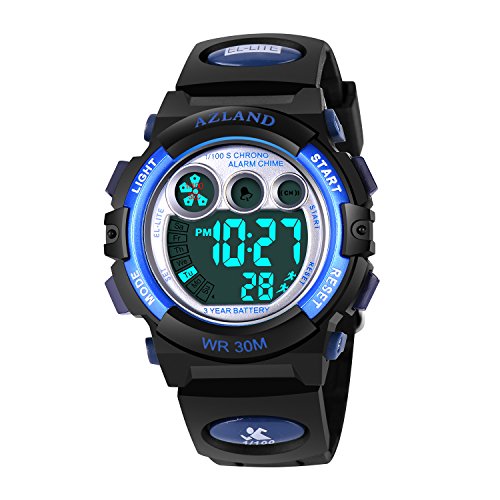
This screenshot has width=500, height=500. In order to click on light button in this screenshot , I will do `click(118, 177)`.